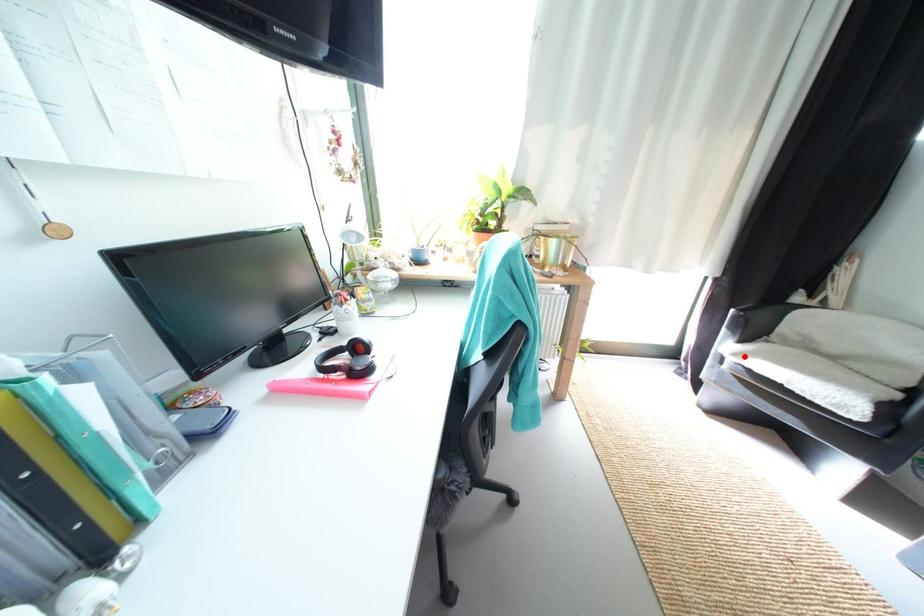
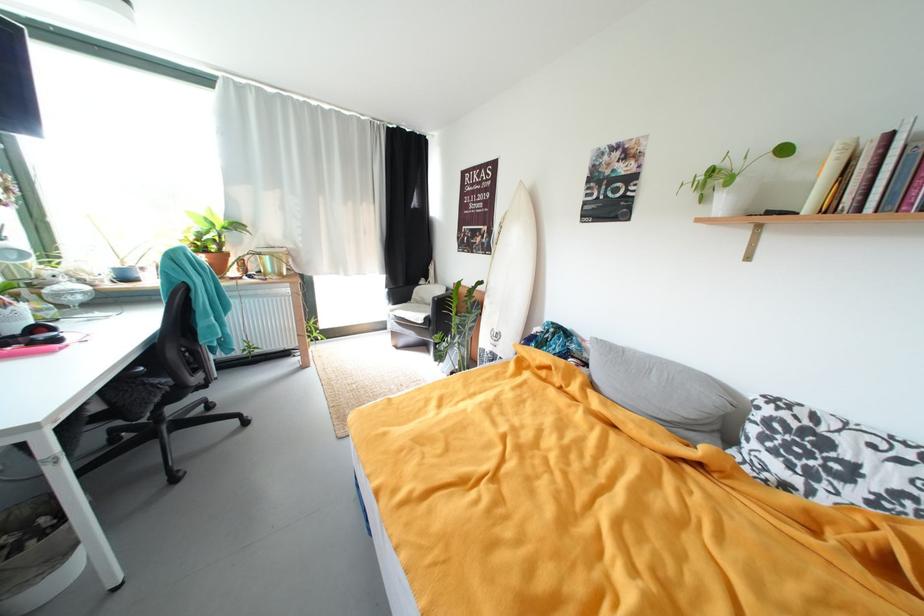
Where in the second image is the point corresponding to the highlighted location from the first image?

(399, 313)